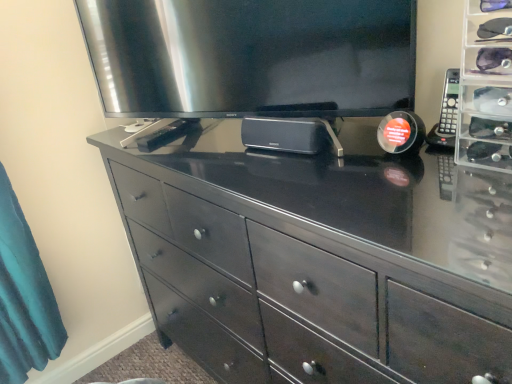
Where is `satin silver television at upper center`? satin silver television at upper center is located at coordinates (251, 56).

The image size is (512, 384). Identify the location of black plastic remote at right. (449, 105).

What do you see at coordinates (449, 105) in the screenshot? This screenshot has width=512, height=384. I see `black plastic remote at right` at bounding box center [449, 105].

Where is `satin silver television at upper center`? This screenshot has height=384, width=512. satin silver television at upper center is located at coordinates (251, 56).

Are satin silver television at upper center and dark wood dresser at center far apart?

They are positioned close to each other.

Would you say satin silver television at upper center is to the left or to the right of dark wood dresser at center in the picture?

In the image, satin silver television at upper center appears on the left side of dark wood dresser at center.

Is satin silver television at upper center looking in the opposite direction of dark wood dresser at center?

No, satin silver television at upper center is not facing away from dark wood dresser at center.

Can you tell me how much satin silver television at upper center and black plastic remote at right differ in facing direction?

satin silver television at upper center and black plastic remote at right are facing 19.4 degrees away from each other.

In terms of width, does satin silver television at upper center look wider or thinner when compared to black plastic remote at right?

Clearly, satin silver television at upper center has more width compared to black plastic remote at right.

From the image's perspective, is satin silver television at upper center on top of black plastic remote at right?

Yes, from the image's perspective, satin silver television at upper center is on top of black plastic remote at right.

In the scene shown: Which point is more forward, (315, 47) or (454, 114)?

The point (454, 114) is closer to the camera.

From the image's perspective, which is above, dark wood dresser at center or satin silver television at upper center?

satin silver television at upper center.

Who is bigger, dark wood dresser at center or satin silver television at upper center?

With larger size is dark wood dresser at center.

Considering the sizes of objects dark wood dresser at center and satin silver television at upper center in the image provided, who is shorter, dark wood dresser at center or satin silver television at upper center?

satin silver television at upper center is shorter.

Between point (259, 246) and point (163, 62), which one is positioned behind?

The point (163, 62) is behind.

Is black plastic remote at right positioned with its back to satin silver television at upper center?

No.

Which of these two, black plastic remote at right or satin silver television at upper center, stands shorter?

black plastic remote at right.

From a real-world perspective, which object rests below the other?

black plastic remote at right, from a real-world perspective.

Who is smaller, black plastic remote at right or dark wood dresser at center?

With smaller size is black plastic remote at right.

Considering the relative positions of black plastic remote at right and dark wood dresser at center in the image provided, is black plastic remote at right to the right of dark wood dresser at center from the viewer's perspective?

Indeed, black plastic remote at right is positioned on the right side of dark wood dresser at center.

Considering the sizes of objects black plastic remote at right and dark wood dresser at center in the image provided, who is thinner, black plastic remote at right or dark wood dresser at center?

Thinner between the two is black plastic remote at right.

Is black plastic remote at right oriented towards dark wood dresser at center?

No, black plastic remote at right is not aimed at dark wood dresser at center.

Looking at this image, considering the sizes of objects dark wood dresser at center and black plastic remote at right in the image provided, who is thinner, dark wood dresser at center or black plastic remote at right?

black plastic remote at right is thinner.

Is dark wood dresser at center looking in the opposite direction of black plastic remote at right?

dark wood dresser at center does not have its back to black plastic remote at right.

From a real-world perspective, is dark wood dresser at center positioned above or below black plastic remote at right?

dark wood dresser at center is situated lower than black plastic remote at right in the real world.

Image resolution: width=512 pixels, height=384 pixels. I want to click on television on the left of dark wood dresser at center, so click(251, 56).

Locate an element on the screen. control below the satin silver television at upper center (from a real-world perspective) is located at coordinates (449, 105).

Looking at the image, which one is located closer to satin silver television at upper center, dark wood dresser at center or black plastic remote at right?

dark wood dresser at center is closer to satin silver television at upper center.

Looking at the image, which one is located further to dark wood dresser at center, black plastic remote at right or satin silver television at upper center?

The object further to dark wood dresser at center is black plastic remote at right.

Based on their spatial positions, is black plastic remote at right or dark wood dresser at center closer to satin silver television at upper center?

The object closer to satin silver television at upper center is dark wood dresser at center.

Based on their spatial positions, is dark wood dresser at center or satin silver television at upper center closer to black plastic remote at right?

The object closer to black plastic remote at right is satin silver television at upper center.

Which object lies further to the anchor point black plastic remote at right, satin silver television at upper center or dark wood dresser at center?

dark wood dresser at center lies further to black plastic remote at right than the other object.

From the picture: Looking at the image, which one is located closer to dark wood dresser at center, satin silver television at upper center or black plastic remote at right?

Among the two, satin silver television at upper center is located nearer to dark wood dresser at center.

Image resolution: width=512 pixels, height=384 pixels. In order to click on control between satin silver television at upper center and dark wood dresser at center in the up-down direction in this screenshot , I will do `click(449, 105)`.